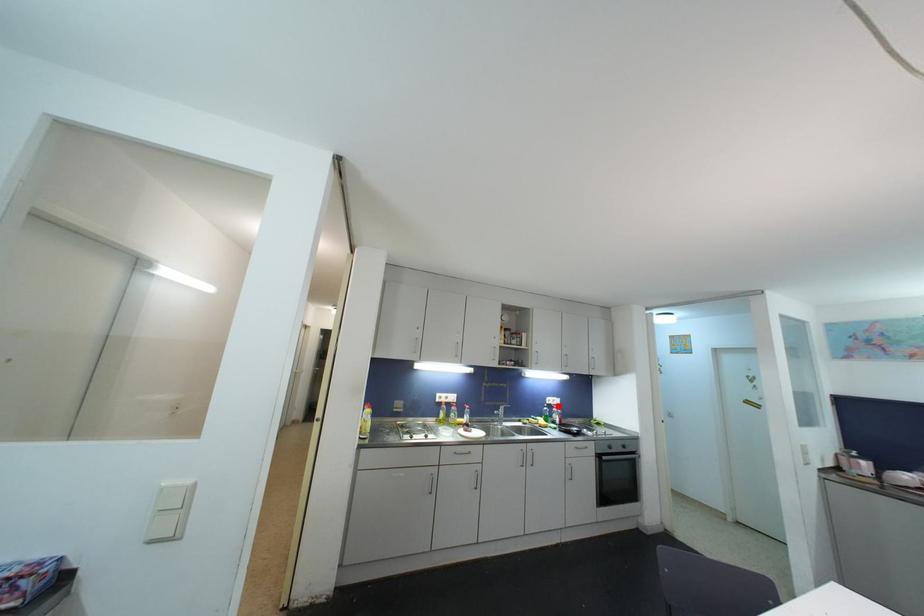
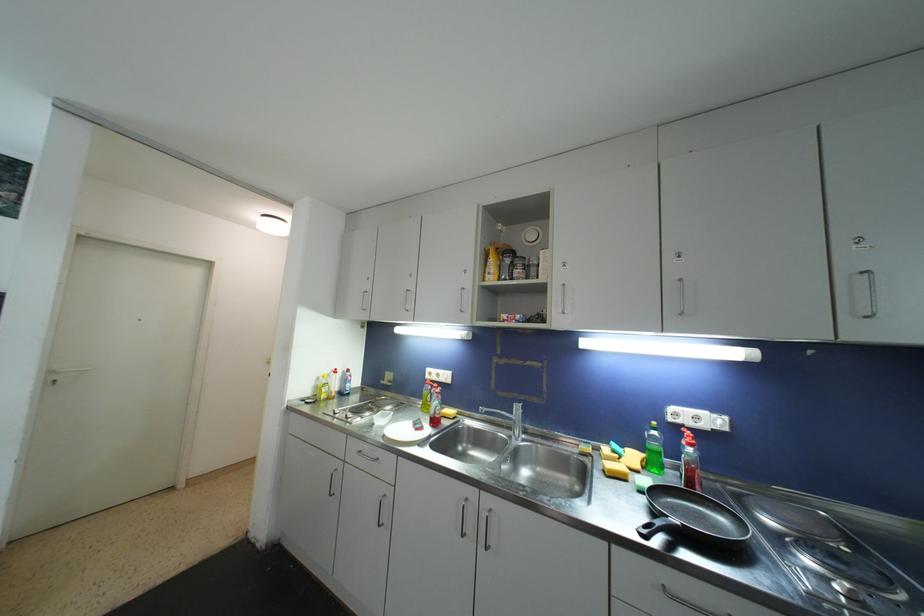
Question: I am providing you with two images of the same scene from different viewpoints. In image1, a red point is highlighted. Considering the same 3D point in image2, which of the following is correct?

Choices:
 (A) It is closer
 (B) It is farther

Answer: (A)